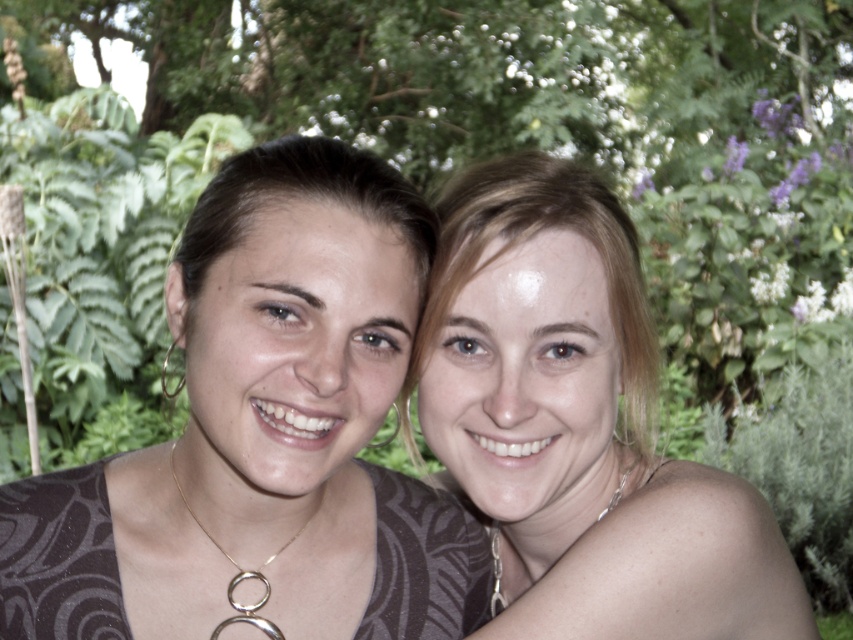
Who is taller, gold metallic necklace at center or silver metallic chain at lower right?

Standing taller between the two is silver metallic chain at lower right.

Between point (241, 605) and point (621, 474), which one is positioned behind?

The point (621, 474) is behind.

You are a GUI agent. You are given a task and a screenshot of the screen. Output one action in this format:
    pyautogui.click(x=<x>, y=<y>)
    Task: Click on the gold metallic necklace at center
    The width and height of the screenshot is (853, 640).
    Given the screenshot: What is the action you would take?
    pyautogui.click(x=239, y=573)

Does smooth blonde hair at center have a lesser width compared to silver metallic chain at lower right?

Incorrect, smooth blonde hair at center's width is not less than silver metallic chain at lower right's.

Which is behind, point (450, 404) or point (618, 493)?

The point (618, 493) is more distant.

This screenshot has height=640, width=853. What are the coordinates of `smooth blonde hair at center` in the screenshot? It's located at (579, 426).

Who is positioned more to the right, matte black shirt at center or gold metallic necklace at center?

From the viewer's perspective, matte black shirt at center appears more on the right side.

Between matte black shirt at center and gold metallic necklace at center, which one is positioned higher?

matte black shirt at center is higher up.

Describe the element at coordinates (264, 435) in the screenshot. I see `matte black shirt at center` at that location.

Locate an element on the screen. The image size is (853, 640). matte black shirt at center is located at coordinates (264, 435).